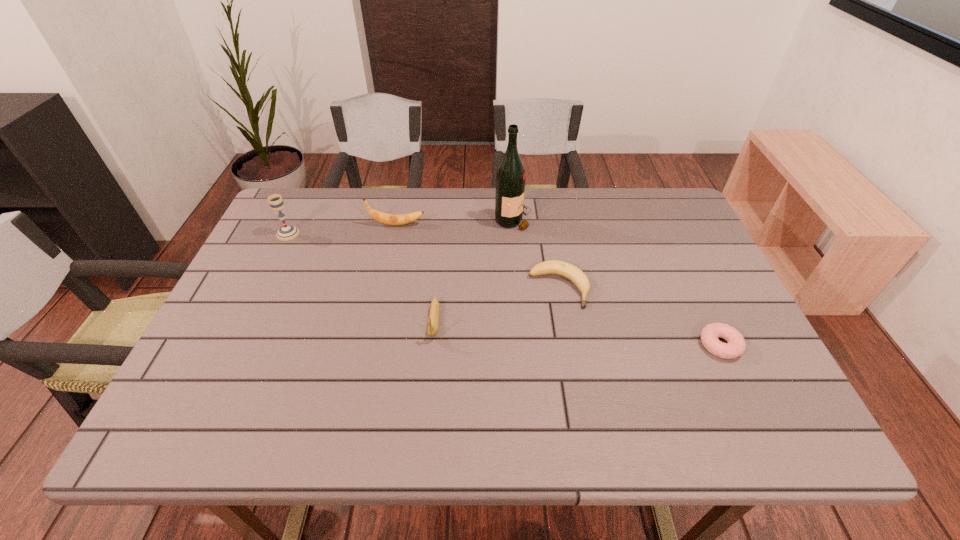
Where is `the tallest object`? The height and width of the screenshot is (540, 960). the tallest object is located at coordinates (510, 177).

The height and width of the screenshot is (540, 960). I want to click on the leftmost object, so click(287, 232).

The width and height of the screenshot is (960, 540). I want to click on chalice, so click(287, 232).

Locate an element on the screen. This screenshot has height=540, width=960. the leftmost banana is located at coordinates (389, 219).

Locate an element on the screen. the tallest banana is located at coordinates (389, 219).

The width and height of the screenshot is (960, 540). Identify the location of the fourth object from right to left. (433, 320).

Locate an element on the screen. The image size is (960, 540). the second shortest banana is located at coordinates (433, 320).

This screenshot has width=960, height=540. I want to click on the shortest banana, so click(x=569, y=271).

I want to click on doughnut, so click(x=735, y=347).

You are a GUI agent. You are given a task and a screenshot of the screen. Output one action in this format:
    pyautogui.click(x=<x>, y=<y>)
    Task: Click on the shortest object
    Image resolution: width=960 pixels, height=540 pixels.
    Given the screenshot: What is the action you would take?
    pyautogui.click(x=735, y=347)